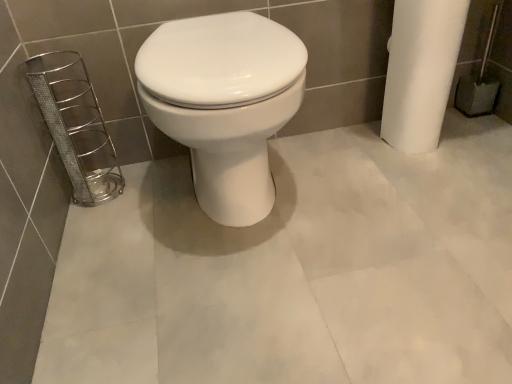
This screenshot has height=384, width=512. Find the location of `vacant space to the right of white glossy toilet at center`. vacant space to the right of white glossy toilet at center is located at coordinates (378, 198).